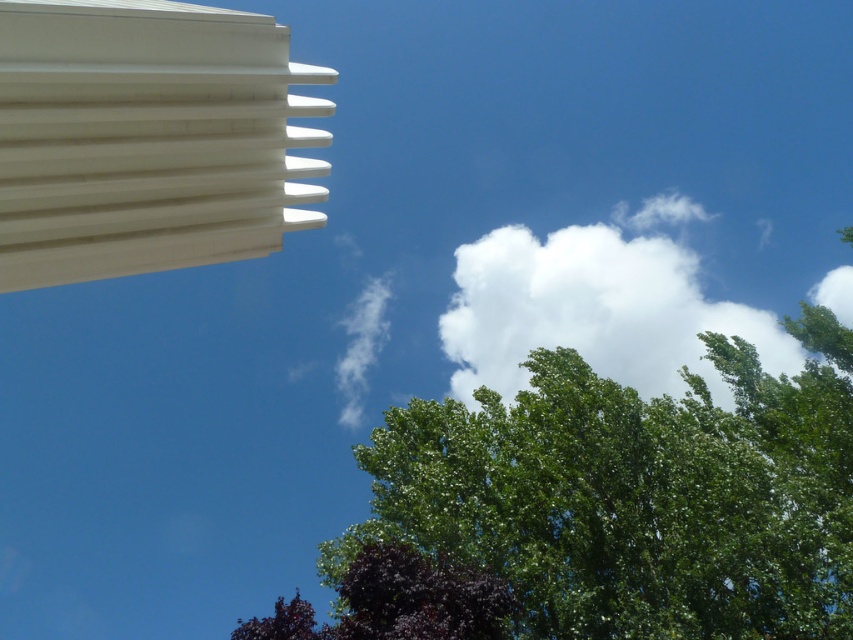
You are standing in the middle of the scene and want to look at both the white fluffy cloud at upper center and the dark purple leafy tree at lower center. Which direction should you turn your head to look from the tree to the cloud?

You should turn your head upward and to the right to look from the dark purple leafy tree at lower center to the white fluffy cloud at upper center since the cloud is positioned to the right of the tree.

Based on the photo, you are standing in the middle of the scene and want to walk to the dark purple leafy tree at lower center. There is a white fluffy cloud at upper center blocking your path. Can you walk around it?

The white fluffy cloud at upper center and dark purple leafy tree at lower center are 134.20 feet apart. Since clouds are in the sky and trees are on the ground, you can easily walk around the white fluffy cloud at upper center to reach the dark purple leafy tree at lower center.